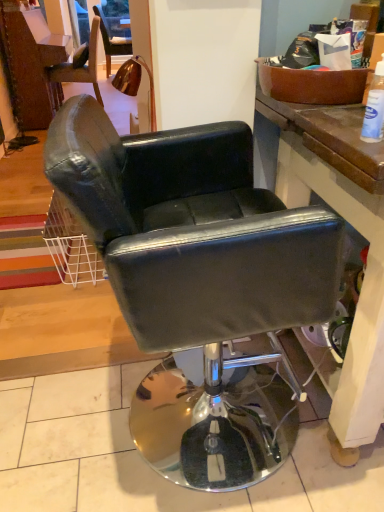
Question: From the image's perspective, is black leather chair at center above or below white plastic bottle at upper right?

Choices:
 (A) below
 (B) above

Answer: (A)

Question: Considering the positions of black leather chair at center and white plastic bottle at upper right in the image, is black leather chair at center taller or shorter than white plastic bottle at upper right?

Choices:
 (A) tall
 (B) short

Answer: (A)

Question: From a real-world perspective, is black leather chair at center positioned above or below white plastic bottle at upper right?

Choices:
 (A) below
 (B) above

Answer: (A)

Question: From a real-world perspective, is white plastic bottle at upper right positioned above or below black leather chair at center?

Choices:
 (A) above
 (B) below

Answer: (A)

Question: Considering the relative positions of white plastic bottle at upper right and black leather chair at center in the image provided, is white plastic bottle at upper right to the left or to the right of black leather chair at center?

Choices:
 (A) left
 (B) right

Answer: (B)

Question: Considering the positions of white plastic bottle at upper right and black leather chair at center in the image, is white plastic bottle at upper right bigger or smaller than black leather chair at center?

Choices:
 (A) small
 (B) big

Answer: (A)

Question: Is white plastic bottle at upper right wider or thinner than black leather chair at center?

Choices:
 (A) wide
 (B) thin

Answer: (B)